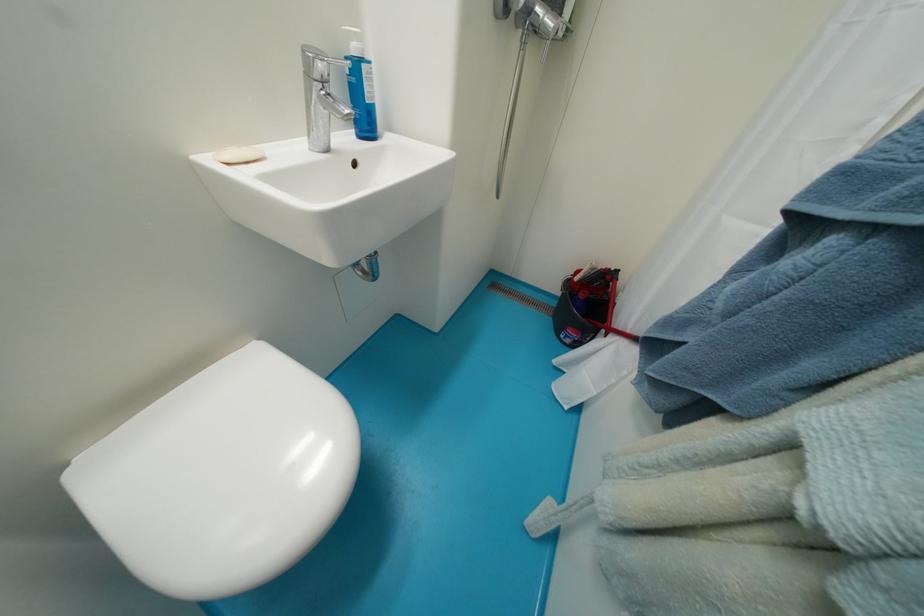
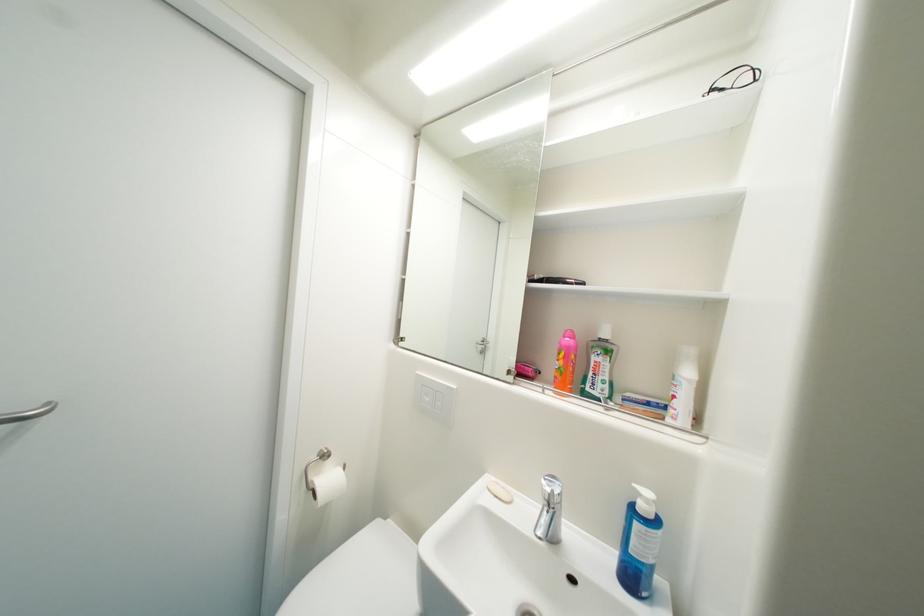
Where in the second image is the point corresponding to (363,41) from the first image?

(653, 503)